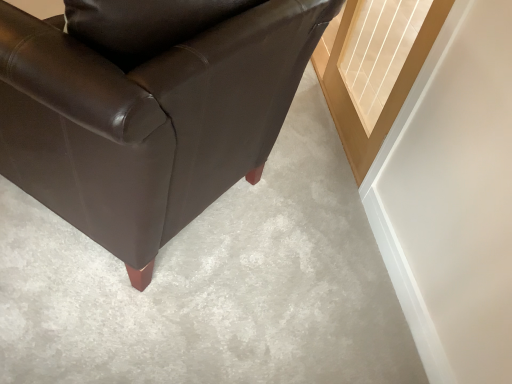
What are the coordinates of `vacant area located to the right-hand side of matte black leather chair at lower left` in the screenshot? It's located at (309, 254).